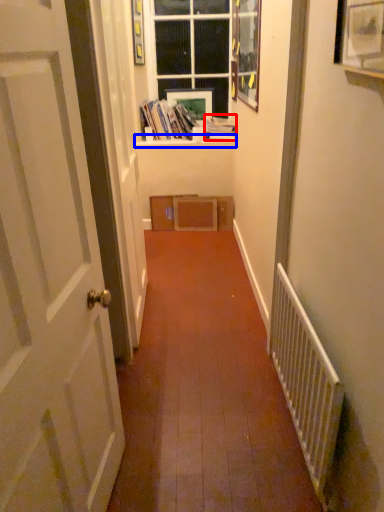
Question: Which point is further to the camera, book (highlighted by a red box) or window sill (highlighted by a blue box)?

Choices:
 (A) book
 (B) window sill

Answer: (B)